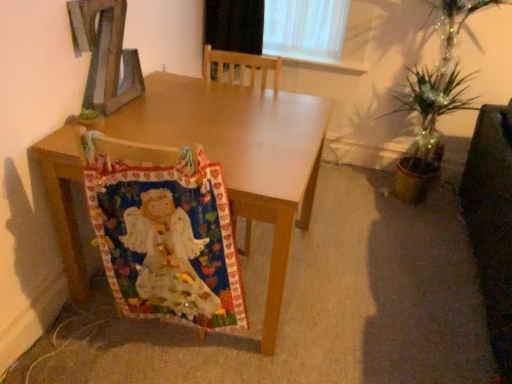
Question: Could you tell me if wooden letter z at upper left is facing multicolored fabric at lower left?

Choices:
 (A) yes
 (B) no

Answer: (B)

Question: Can you confirm if wooden letter z at upper left is wider than multicolored fabric at lower left?

Choices:
 (A) yes
 (B) no

Answer: (B)

Question: Is wooden letter z at upper left positioned with its back to multicolored fabric at lower left?

Choices:
 (A) no
 (B) yes

Answer: (A)

Question: Is wooden letter z at upper left far away from multicolored fabric at lower left?

Choices:
 (A) no
 (B) yes

Answer: (A)

Question: Is wooden letter z at upper left further to camera compared to multicolored fabric at lower left?

Choices:
 (A) yes
 (B) no

Answer: (A)

Question: From a real-world perspective, is multicolored fabric at lower left physically located above or below wooden letter z at upper left?

Choices:
 (A) below
 (B) above

Answer: (A)

Question: Considering the positions of multicolored fabric at lower left and wooden letter z at upper left in the image, is multicolored fabric at lower left bigger or smaller than wooden letter z at upper left?

Choices:
 (A) big
 (B) small

Answer: (A)

Question: Is multicolored fabric at lower left situated inside wooden letter z at upper left or outside?

Choices:
 (A) outside
 (B) inside

Answer: (A)

Question: From their relative heights in the image, would you say multicolored fabric at lower left is taller or shorter than wooden letter z at upper left?

Choices:
 (A) short
 (B) tall

Answer: (B)

Question: Is point (504, 251) closer or farther from the camera than point (134, 192)?

Choices:
 (A) closer
 (B) farther

Answer: (B)

Question: In the image, is dark brown leather swivel chair at right positioned in front of or behind multicolored fabric at lower left?

Choices:
 (A) front
 (B) behind

Answer: (A)

Question: Would you say dark brown leather swivel chair at right is inside or outside multicolored fabric at lower left?

Choices:
 (A) outside
 (B) inside

Answer: (A)

Question: Visually, is dark brown leather swivel chair at right positioned to the left or to the right of multicolored fabric at lower left?

Choices:
 (A) left
 (B) right

Answer: (B)

Question: Which is correct: multicolored fabric at lower left is inside wooden table at center, or outside of it?

Choices:
 (A) inside
 (B) outside

Answer: (A)

Question: Considering their positions, is multicolored fabric at lower left located in front of or behind wooden table at center?

Choices:
 (A) front
 (B) behind

Answer: (A)